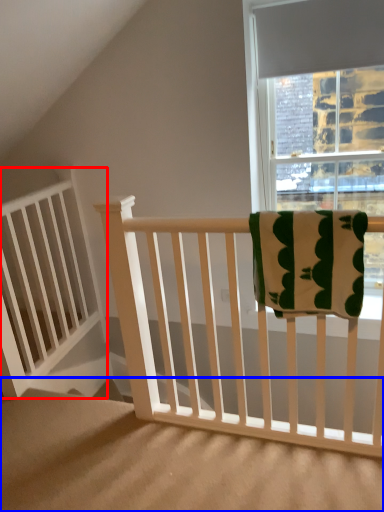
Question: Among these objects, which one is nearest to the camera, balustrade (highlighted by a red box) or stairs (highlighted by a blue box)?

Choices:
 (A) balustrade
 (B) stairs

Answer: (B)